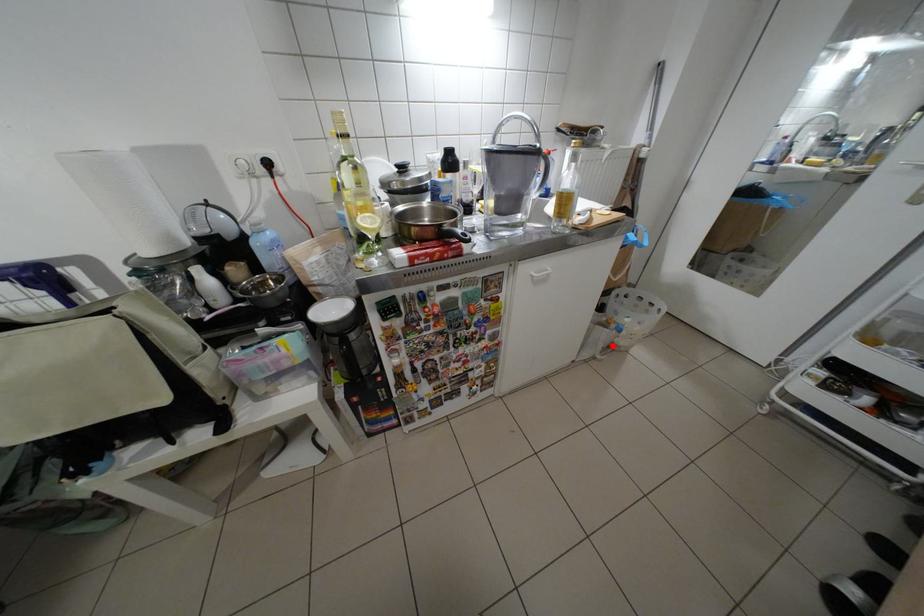
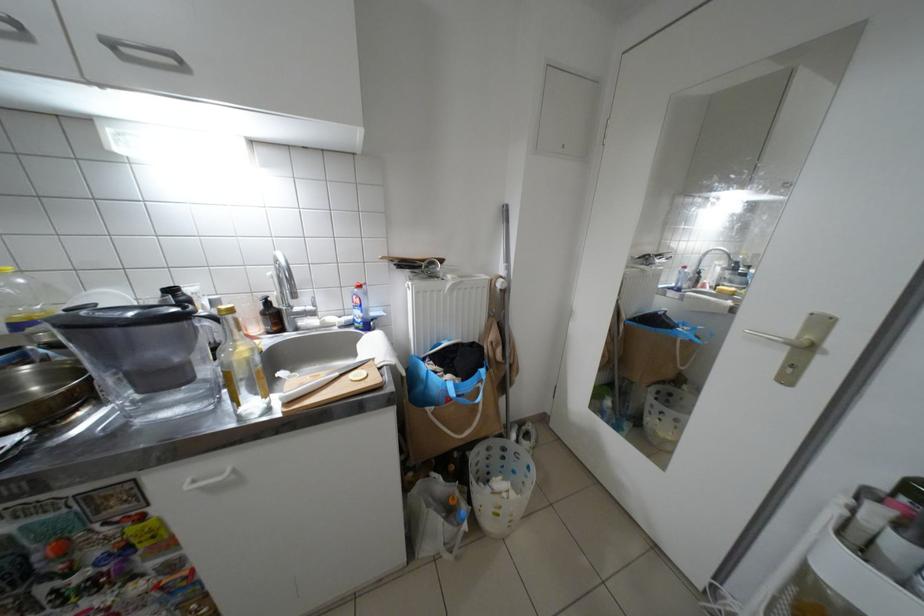
Where in the second image is the point corresponding to the highlighted location from the first image?

(453, 541)